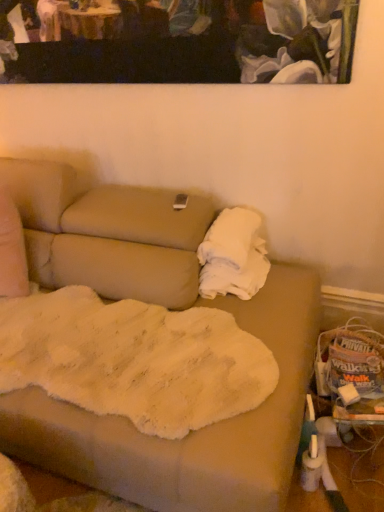
In order to click on white fluffy blanket at right in this screenshot , I will do `click(233, 256)`.

Describe the element at coordinates (233, 256) in the screenshot. Image resolution: width=384 pixels, height=512 pixels. I see `white fluffy blanket at right` at that location.

Measure the distance between white fluffy blanket at right and camera.

The distance of white fluffy blanket at right from camera is 5.73 feet.

Consider the image. In order to face painted canvas at upper center, should I rotate leftwards or rightwards?

A 6.584 degree turn to the left will do.

Describe the element at coordinates (179, 41) in the screenshot. I see `painted canvas at upper center` at that location.

Where is `painted canvas at upper center`? This screenshot has height=512, width=384. painted canvas at upper center is located at coordinates (179, 41).

The width and height of the screenshot is (384, 512). I want to click on white fluffy blanket at right, so click(233, 256).

Is painted canvas at upper center to the left of white fluffy blanket at right from the viewer's perspective?

Yes.

Does painted canvas at upper center lie behind white fluffy blanket at right?

No, painted canvas at upper center is closer to the viewer.

Based on the photo, which is closer, (292, 21) or (217, 224)?

The point (292, 21) is in front.

From the image's perspective, is painted canvas at upper center located above or below white fluffy blanket at right?

Based on their image positions, painted canvas at upper center is located above white fluffy blanket at right.

From a real-world perspective, who is located lower, painted canvas at upper center or white fluffy blanket at right?

In real-world perspective, white fluffy blanket at right is lower.

Considering the relative sizes of painted canvas at upper center and white fluffy blanket at right in the image provided, is painted canvas at upper center thinner than white fluffy blanket at right?

Indeed, painted canvas at upper center has a lesser width compared to white fluffy blanket at right.

In terms of height, does painted canvas at upper center look taller or shorter compared to white fluffy blanket at right?

painted canvas at upper center is taller than white fluffy blanket at right.

Considering the relative sizes of painted canvas at upper center and white fluffy blanket at right in the image provided, is painted canvas at upper center smaller than white fluffy blanket at right?

Yes, painted canvas at upper center is smaller than white fluffy blanket at right.

Is white fluffy blanket at right surrounded by painted canvas at upper center?

Definitely not — white fluffy blanket at right is not inside painted canvas at upper center.

Is painted canvas at upper center far away from white fluffy blanket at right?

No, painted canvas at upper center is in close proximity to white fluffy blanket at right.

In the scene shown: Is painted canvas at upper center oriented towards white fluffy blanket at right?

No, painted canvas at upper center is not oriented towards white fluffy blanket at right.

Can you tell me how much painted canvas at upper center and white fluffy blanket at right differ in facing direction?

The angular difference between painted canvas at upper center and white fluffy blanket at right is 1.38 degrees.

The height and width of the screenshot is (512, 384). I want to click on cloth behind the painted canvas at upper center, so click(233, 256).

Does white fluffy blanket at right appear on the right side of painted canvas at upper center?

Yes, white fluffy blanket at right is to the right of painted canvas at upper center.

Based on the photo, which object is closer to the camera, white fluffy blanket at right or painted canvas at upper center?

painted canvas at upper center is closer to the camera.

Does point (259, 244) come farther from viewer compared to point (244, 15)?

Yes, point (259, 244) is behind point (244, 15).

From the image's perspective, which one is positioned higher, white fluffy blanket at right or painted canvas at upper center?

painted canvas at upper center.

From a real-world perspective, who is located higher, white fluffy blanket at right or painted canvas at upper center?

painted canvas at upper center, from a real-world perspective.

Considering the sizes of white fluffy blanket at right and painted canvas at upper center in the image, is white fluffy blanket at right wider or thinner than painted canvas at upper center?

white fluffy blanket at right is wider than painted canvas at upper center.

Between white fluffy blanket at right and painted canvas at upper center, which one has more height?

Standing taller between the two is painted canvas at upper center.

Between white fluffy blanket at right and painted canvas at upper center, which one has smaller size?

painted canvas at upper center is smaller.

Is white fluffy blanket at right positioned beyond the bounds of painted canvas at upper center?

white fluffy blanket at right lies outside painted canvas at upper center's area.

In the scene shown: Are white fluffy blanket at right and painted canvas at upper center far apart?

No, white fluffy blanket at right is in close proximity to painted canvas at upper center.

Is painted canvas at upper center at the back of white fluffy blanket at right?

No.

Find the location of a particular element. This screenshot has width=384, height=512. cloth on the right of painted canvas at upper center is located at coordinates [233, 256].

The width and height of the screenshot is (384, 512). I want to click on picture frame that is above the white fluffy blanket at right (from a real-world perspective), so click(179, 41).

This screenshot has height=512, width=384. What are the coordinates of `cloth on the right of painted canvas at upper center` in the screenshot? It's located at (233, 256).